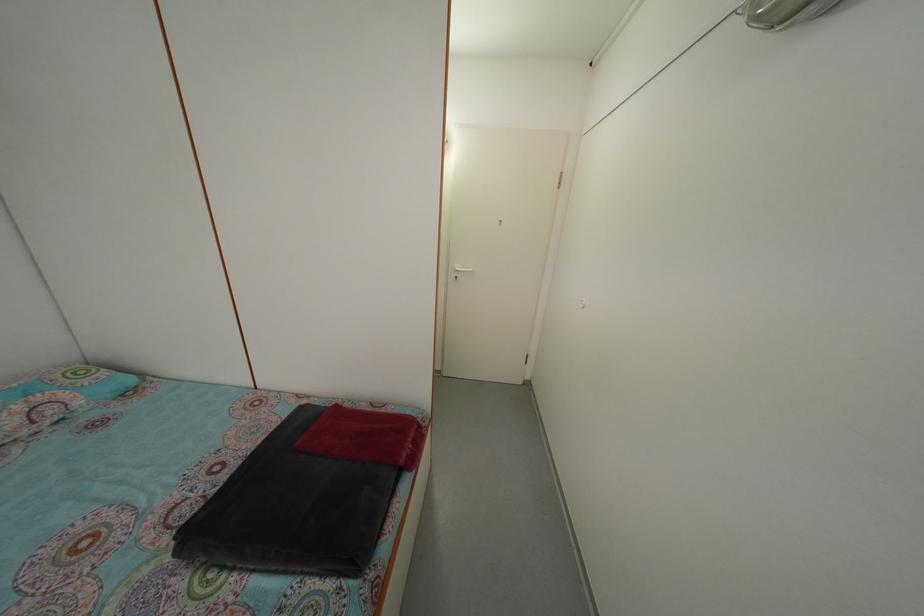
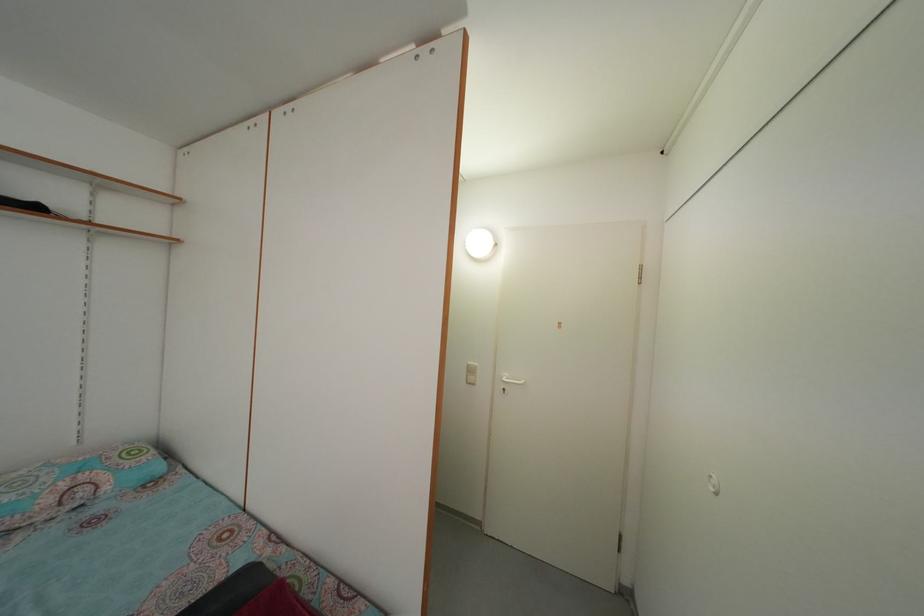
How did the camera likely rotate?

The camera's rotation is toward left-up.